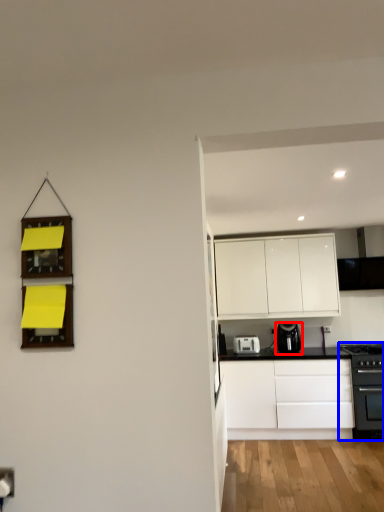
Question: Which object appears closest to the camera in this image, kitchen appliance (highlighted by a red box) or home appliance (highlighted by a blue box)?

Choices:
 (A) kitchen appliance
 (B) home appliance

Answer: (B)